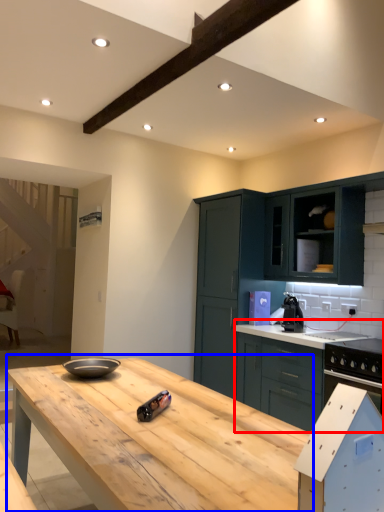
Question: Which object is closer to the camera taking this photo, cabinetry (highlighted by a red box) or table (highlighted by a blue box)?

Choices:
 (A) cabinetry
 (B) table

Answer: (B)